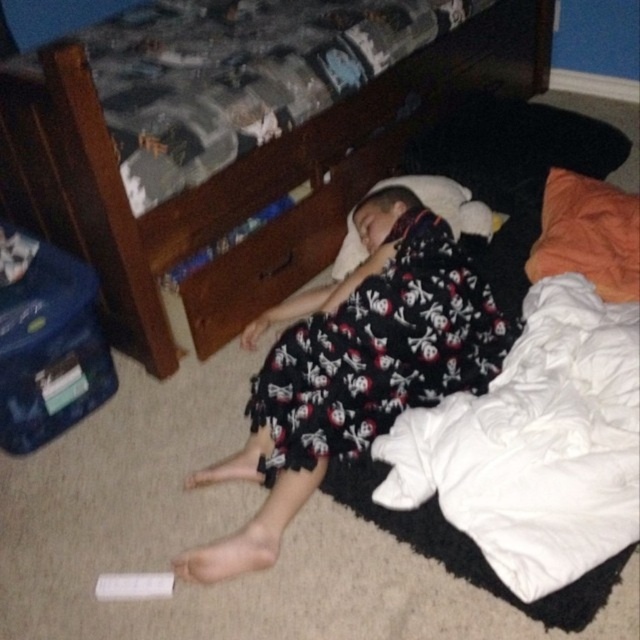
You are trying to reach the wooden bunk bed at upper center from the white soft pillow at center. Which object is taller?

The wooden bunk bed at upper center is taller than the white soft pillow at center.

You are a delivery person who needs to place a package on the wooden drawer at center without disturbing the person lying on the floor. Can you reach the wooden bunk bed at upper center to place the package there instead?

The wooden bunk bed at upper center is above the wooden drawer at center, so you can place the package on the wooden bunk bed at upper center instead of the wooden drawer at center without disturbing the person.